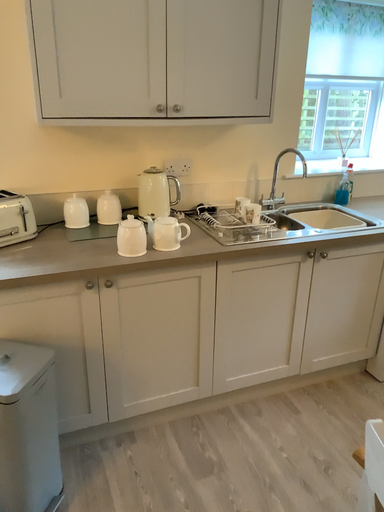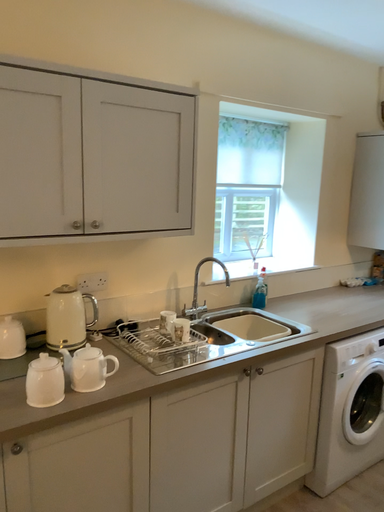
Question: Which way did the camera rotate in the video?

Choices:
 (A) rotated upward
 (B) rotated downward

Answer: (A)